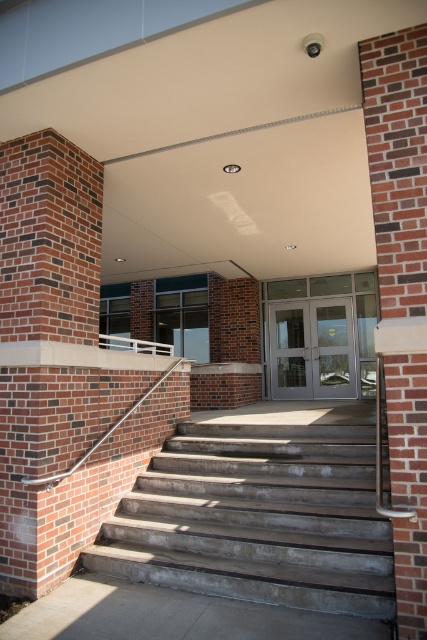
Question: Is concrete/stained at center smaller than satin silver railing at left?

Choices:
 (A) no
 (B) yes

Answer: (A)

Question: From the image, what is the correct spatial relationship of brick column at left in relation to concrete/stained at center?

Choices:
 (A) right
 (B) left

Answer: (B)

Question: Which point is closer to the camera?

Choices:
 (A) matte gray doors at center
 (B) brick column at left
 (C) white plastic rail at upper center
 (D) concrete/stained at center

Answer: (D)

Question: Estimate the real-world distances between objects in this image. Which object is farther from the brick column at left?

Choices:
 (A) matte gray doors at center
 (B) concrete/stained at center
 (C) satin silver railing at left

Answer: (A)

Question: Is concrete/stained at center bigger than satin silver railing at left?

Choices:
 (A) yes
 (B) no

Answer: (A)

Question: Among these points, which one is farthest from the camera?

Choices:
 (A) (x=146, y=552)
 (B) (x=424, y=557)

Answer: (A)